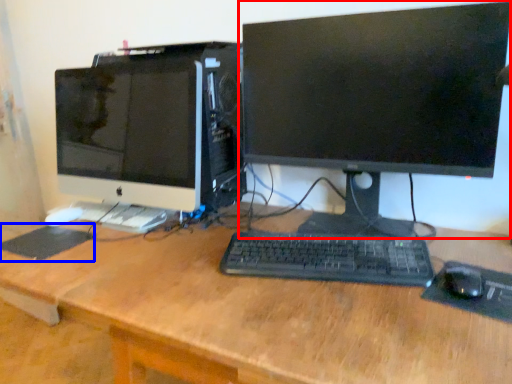
Question: Among these objects, which one is farthest to the camera, computer monitor (highlighted by a red box) or mousepad (highlighted by a blue box)?

Choices:
 (A) computer monitor
 (B) mousepad

Answer: (B)